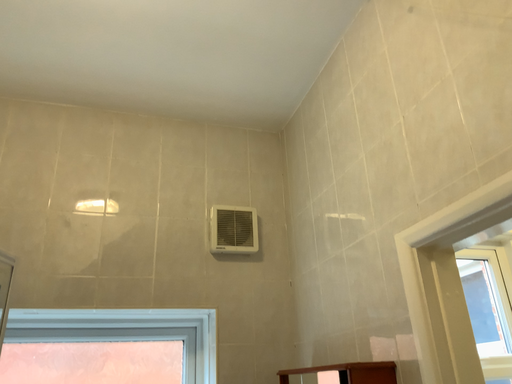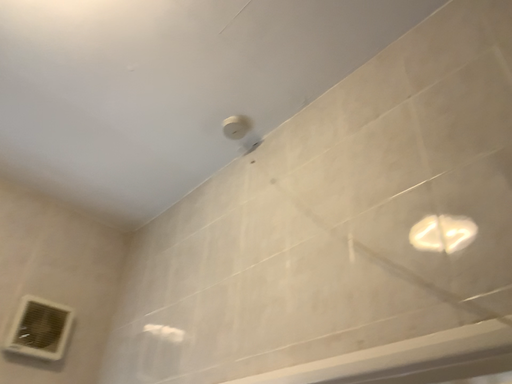
Question: How did the camera likely rotate when shooting the video?

Choices:
 (A) rotated left
 (B) rotated right

Answer: (B)